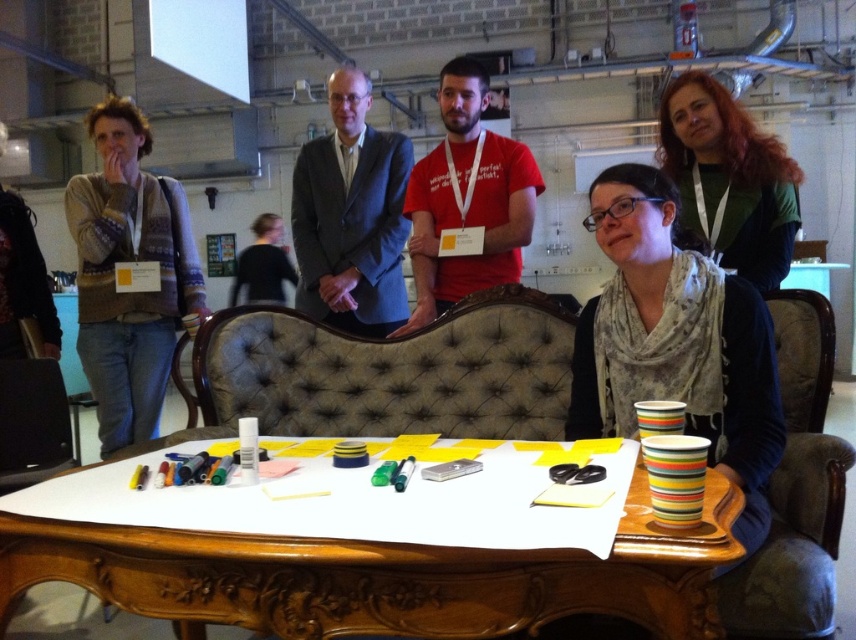
Question: Does knitted sweater at left have a greater width compared to black leather chair at lower left?

Choices:
 (A) yes
 (B) no

Answer: (A)

Question: Among these points, which one is nearest to the camera?

Choices:
 (A) (10, 428)
 (B) (810, 330)
 (C) (492, 166)

Answer: (B)

Question: Considering the real-world distances, which object is closest to the green jersey at upper right?

Choices:
 (A) matte black suit at center
 (B) black leather chair at lower left

Answer: (A)

Question: Considering the relative positions of brown fabric chair at center and black leather chair at lower left in the image provided, where is brown fabric chair at center located with respect to black leather chair at lower left?

Choices:
 (A) right
 (B) left

Answer: (A)

Question: Estimate the real-world distances between objects in this image. Which object is closer to the wooden table at center?

Choices:
 (A) brown fabric chair at center
 (B) knitted sweater at left
 (C) matte red t-shirt at center

Answer: (A)

Question: Does matte red t-shirt at center lie behind black leather chair at lower left?

Choices:
 (A) yes
 (B) no

Answer: (A)